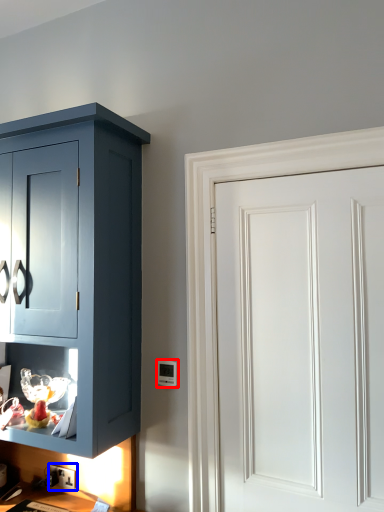
Question: Which object is closer to the camera taking this photo, light switch (highlighted by a red box) or electric outlet (highlighted by a blue box)?

Choices:
 (A) light switch
 (B) electric outlet

Answer: (A)